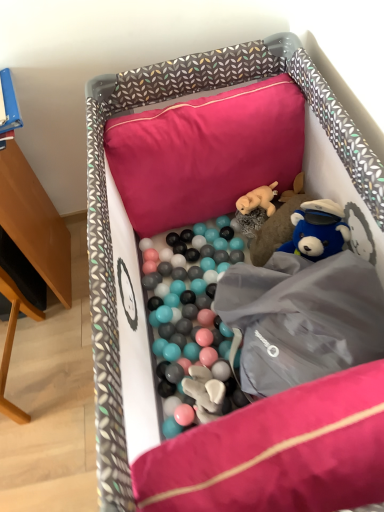
The height and width of the screenshot is (512, 384). What do you see at coordinates (278, 224) in the screenshot?
I see `fluffy plush bear at center, acting as the 1th toy starting from the bottom` at bounding box center [278, 224].

The height and width of the screenshot is (512, 384). What are the coordinates of `fluffy plush bear at center, which appears as the second toy when viewed from the top` in the screenshot? It's located at (278, 224).

Between pink fabric pillow at upper center and soft fabric playpen at center, which one is positioned behind?

pink fabric pillow at upper center is behind.

The image size is (384, 512). Find the location of `infant bed that is under the pink fabric pillow at upper center (from a real-world perspective)`. infant bed that is under the pink fabric pillow at upper center (from a real-world perspective) is located at coordinates [108, 209].

From their relative heights in the image, would you say pink fabric pillow at upper center is taller or shorter than soft fabric playpen at center?

Considering their sizes, pink fabric pillow at upper center has less height than soft fabric playpen at center.

Is pink fabric pillow at upper center oriented towards soft fabric playpen at center?

Yes, pink fabric pillow at upper center is oriented towards soft fabric playpen at center.

Considering the relative positions of soft fabric playpen at center and fluffy plush bear at center, which appears as the second toy when viewed from the top, in the image provided, is soft fabric playpen at center to the left of fluffy plush bear at center, which appears as the second toy when viewed from the top, from the viewer's perspective?

Indeed, soft fabric playpen at center is positioned on the left side of fluffy plush bear at center, which appears as the second toy when viewed from the top.

Which is less distant, (113, 431) or (275, 229)?

Point (113, 431) is positioned closer to the camera compared to point (275, 229).

From a real-world perspective, is soft fabric playpen at center physically above fluffy plush bear at center, acting as the 1th toy starting from the bottom?

Correct, in the physical world, soft fabric playpen at center is higher than fluffy plush bear at center, acting as the 1th toy starting from the bottom.

From the image's perspective, between soft fabric playpen at center and fluffy plush bear at center, which appears as the second toy when viewed from the top, who is located below?

soft fabric playpen at center appears lower in the image.

From the image's perspective, which is below, pink fabric pillow at upper center or fluffy plush bear at center, which appears as the second toy when viewed from the top?

fluffy plush bear at center, which appears as the second toy when viewed from the top, is shown below in the image.

Looking at this image, is fluffy plush bear at center, which appears as the second toy when viewed from the top, surrounded by pink fabric pillow at upper center?

Definitely not — fluffy plush bear at center, which appears as the second toy when viewed from the top, is not inside pink fabric pillow at upper center.

Considering the relative positions of pink fabric pillow at upper center and fluffy plush bear at center, which appears as the second toy when viewed from the top, in the image provided, is pink fabric pillow at upper center to the left of fluffy plush bear at center, which appears as the second toy when viewed from the top, from the viewer's perspective?

Indeed, pink fabric pillow at upper center is positioned on the left side of fluffy plush bear at center, which appears as the second toy when viewed from the top.

Are fuzzy beige dog at center, acting as the second toy starting from the bottom, and soft fabric playpen at center beside each other?

No, fuzzy beige dog at center, acting as the second toy starting from the bottom, is not in contact with soft fabric playpen at center.

Is fuzzy beige dog at center, acting as the second toy starting from the bottom, inside the boundaries of soft fabric playpen at center, or outside?

The correct answer is: inside.

Is soft fabric playpen at center at the back of fuzzy beige dog at center, acting as the second toy starting from the bottom?

Yes, fuzzy beige dog at center, acting as the second toy starting from the bottom, is facing away from soft fabric playpen at center.

Does pink fabric pillow at upper center appear on the right side of fuzzy beige dog at center, which is counted as the 1th toy, starting from the top?

No.

Is fuzzy beige dog at center, which is counted as the 1th toy, starting from the top, at the back of pink fabric pillow at upper center?

pink fabric pillow at upper center does not have its back to fuzzy beige dog at center, which is counted as the 1th toy, starting from the top.

Between pink fabric pillow at upper center and fuzzy beige dog at center, acting as the second toy starting from the bottom, which one is positioned behind?

fuzzy beige dog at center, acting as the second toy starting from the bottom, is further away from the camera.

Are pink fabric pillow at upper center and fuzzy beige dog at center, which is counted as the 1th toy, starting from the top, far apart?

No.

Between point (330, 92) and point (132, 192), which one is positioned in front?

The point (330, 92) is closer to the camera.

Can you confirm if soft fabric playpen at center is shorter than pink fabric pillow at upper center?

In fact, soft fabric playpen at center may be taller than pink fabric pillow at upper center.

Looking at this image, can you confirm if soft fabric playpen at center is positioned to the right of pink fabric pillow at upper center?

Correct, you'll find soft fabric playpen at center to the right of pink fabric pillow at upper center.

Could you tell me if soft fabric playpen at center is facing pink fabric pillow at upper center?

Yes, soft fabric playpen at center is facing pink fabric pillow at upper center.

Is point (239, 209) closer to camera compared to point (260, 247)?

No, it is behind (260, 247).

From the image's perspective, which is above, fuzzy beige dog at center, acting as the second toy starting from the bottom, or fluffy plush bear at center, which appears as the second toy when viewed from the top?

fuzzy beige dog at center, acting as the second toy starting from the bottom, appears higher in the image.

Is fuzzy beige dog at center, acting as the second toy starting from the bottom, oriented away from fluffy plush bear at center, which appears as the second toy when viewed from the top?

Absolutely, fuzzy beige dog at center, acting as the second toy starting from the bottom, is directed away from fluffy plush bear at center, which appears as the second toy when viewed from the top.

Does fuzzy beige dog at center, which is counted as the 1th toy, starting from the top, come in front of fluffy plush bear at center, which appears as the second toy when viewed from the top?

No, fuzzy beige dog at center, which is counted as the 1th toy, starting from the top, is further to the viewer.

Where is `pillow lying behind the soft fabric playpen at center`? pillow lying behind the soft fabric playpen at center is located at coordinates (205, 153).

You are a GUI agent. You are given a task and a screenshot of the screen. Output one action in this format:
    pyautogui.click(x=<x>, y=<y>)
    Task: Click on the infant bed in front of the fluffy plush bear at center, which appears as the second toy when viewed from the top
    Image resolution: width=384 pixels, height=512 pixels.
    Given the screenshot: What is the action you would take?
    pyautogui.click(x=108, y=209)

Which object lies further to the anchor point fluffy plush bear at center, acting as the 1th toy starting from the bottom, soft fabric playpen at center or fuzzy beige dog at center, acting as the second toy starting from the bottom?

Based on the image, soft fabric playpen at center appears to be further to fluffy plush bear at center, acting as the 1th toy starting from the bottom.

Looking at the image, which one is located closer to fuzzy beige dog at center, acting as the second toy starting from the bottom, fluffy plush bear at center, which appears as the second toy when viewed from the top, or soft fabric playpen at center?

fluffy plush bear at center, which appears as the second toy when viewed from the top, is closer to fuzzy beige dog at center, acting as the second toy starting from the bottom.

Based on their spatial positions, is fuzzy beige dog at center, acting as the second toy starting from the bottom, or soft fabric playpen at center further from fluffy plush bear at center, acting as the 1th toy starting from the bottom?

Among the two, soft fabric playpen at center is located further to fluffy plush bear at center, acting as the 1th toy starting from the bottom.

Estimate the real-world distances between objects in this image. Which object is further from fluffy plush bear at center, acting as the 1th toy starting from the bottom, pink fabric pillow at upper center or soft fabric playpen at center?

The object further to fluffy plush bear at center, acting as the 1th toy starting from the bottom, is soft fabric playpen at center.

From the image, which object appears to be nearer to pink fabric pillow at upper center, soft fabric playpen at center or fluffy plush bear at center, acting as the 1th toy starting from the bottom?

soft fabric playpen at center is positioned closer to the anchor pink fabric pillow at upper center.

Which object lies nearer to the anchor point soft fabric playpen at center, pink fabric pillow at upper center or fluffy plush bear at center, which appears as the second toy when viewed from the top?

pink fabric pillow at upper center lies closer to soft fabric playpen at center than the other object.

Looking at the image, which one is located further to fluffy plush bear at center, acting as the 1th toy starting from the bottom, pink fabric pillow at upper center or fuzzy beige dog at center, which is counted as the 1th toy, starting from the top?

pink fabric pillow at upper center is positioned further to the anchor fluffy plush bear at center, acting as the 1th toy starting from the bottom.

From the image, which object appears to be nearer to soft fabric playpen at center, pink fabric pillow at upper center or fuzzy beige dog at center, which is counted as the 1th toy, starting from the top?

Based on the image, pink fabric pillow at upper center appears to be nearer to soft fabric playpen at center.

Where is `toy between pink fabric pillow at upper center and fluffy plush bear at center, acting as the 1th toy starting from the bottom, in the horizontal direction`? toy between pink fabric pillow at upper center and fluffy plush bear at center, acting as the 1th toy starting from the bottom, in the horizontal direction is located at coordinates (258, 200).

This screenshot has height=512, width=384. Identify the location of toy located between soft fabric playpen at center and fuzzy beige dog at center, which is counted as the 1th toy, starting from the top, in the depth direction. (278, 224).

Find the location of `pillow between soft fabric playpen at center and fluffy plush bear at center, which appears as the second toy when viewed from the top, in the front-back direction`. pillow between soft fabric playpen at center and fluffy plush bear at center, which appears as the second toy when viewed from the top, in the front-back direction is located at coordinates (205, 153).

The image size is (384, 512). Find the location of `pillow positioned between soft fabric playpen at center and fuzzy beige dog at center, which is counted as the 1th toy, starting from the top, from near to far`. pillow positioned between soft fabric playpen at center and fuzzy beige dog at center, which is counted as the 1th toy, starting from the top, from near to far is located at coordinates (205, 153).